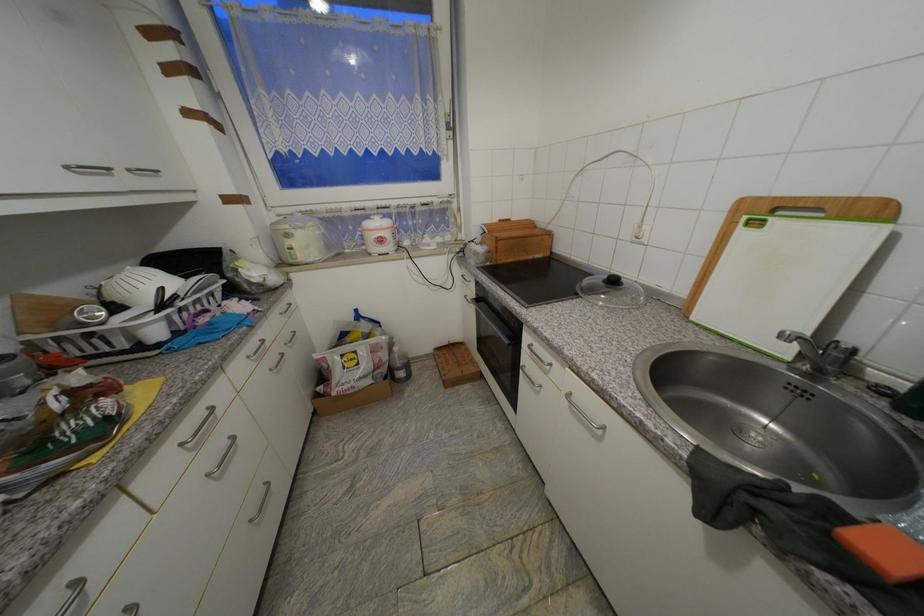
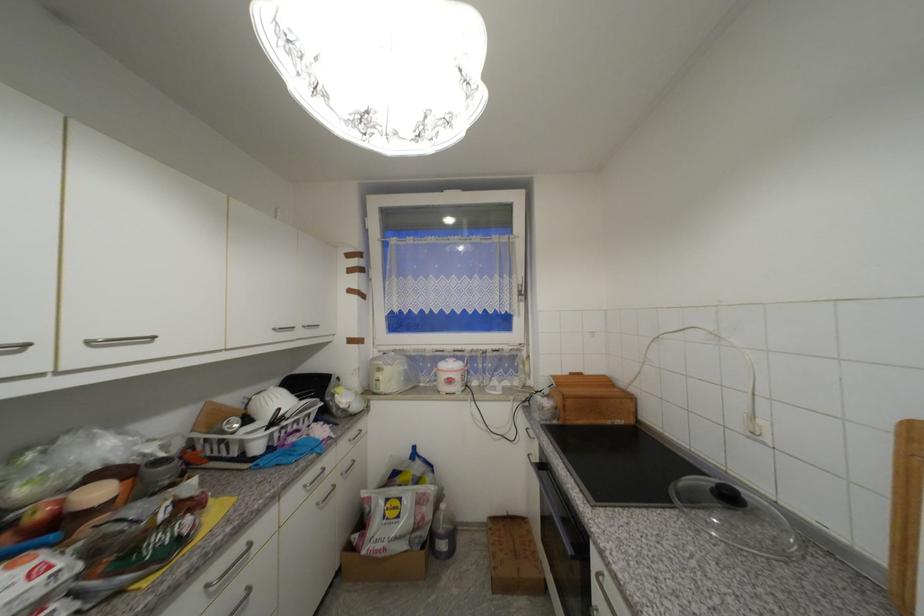
The point at (276,371) is marked in the first image. Where is the corresponding point in the second image?

(322, 505)